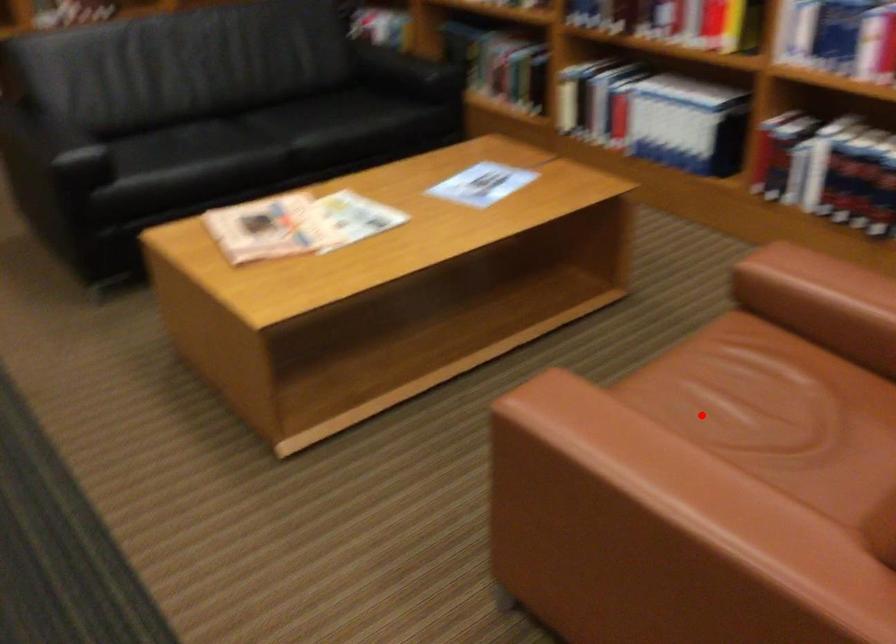
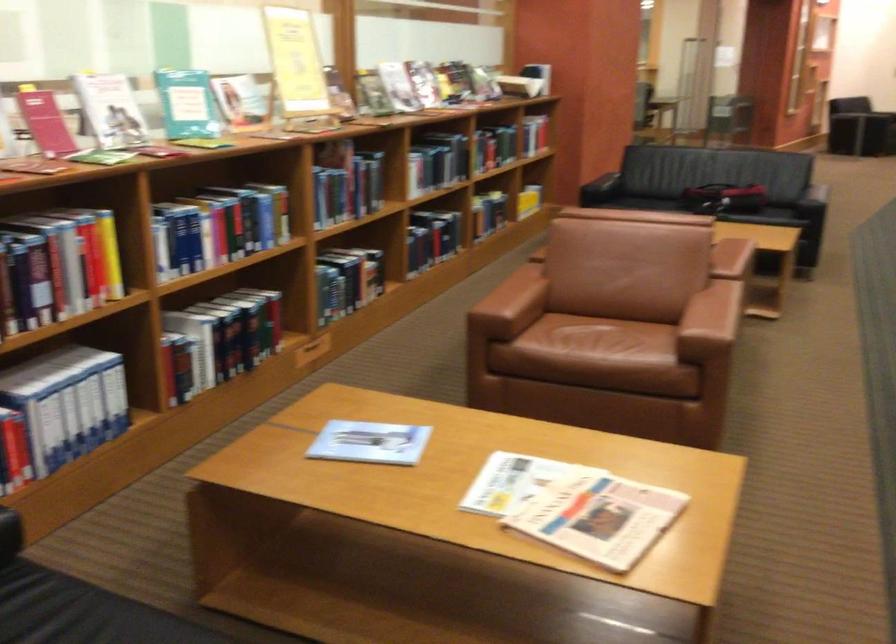
Where in the second image is the point corresponding to the highlighted location from the first image?

(599, 342)